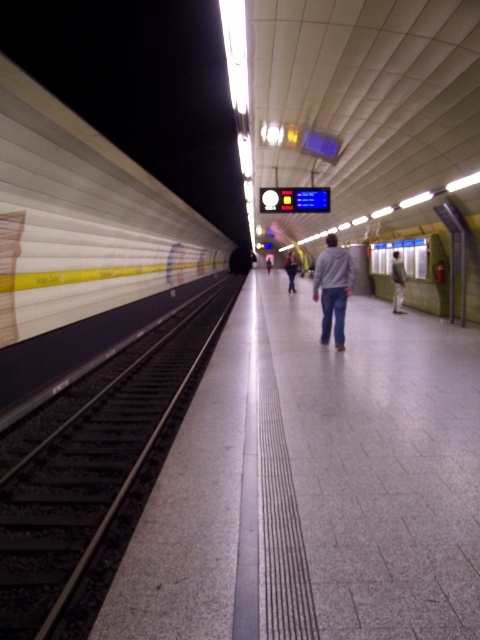
You are standing on the subway platform and see two points marked on the wall. The first point is at coordinate point (397, 266) and the second is at coordinate point (266, 268). Which point is closer to you?

Point (397, 266) is closer to the viewer than point (266, 268).

You are standing on a subway platform at night and notice two people wearing light brown fabric pants at center and light blue jeans at center. If you want to approach the person closer to you, which one should you walk towards?

The light blue jeans at center is closer to you because the light brown fabric pants at center is 38.77 meters away from them, meaning the light blue jeans at center is the nearer option.